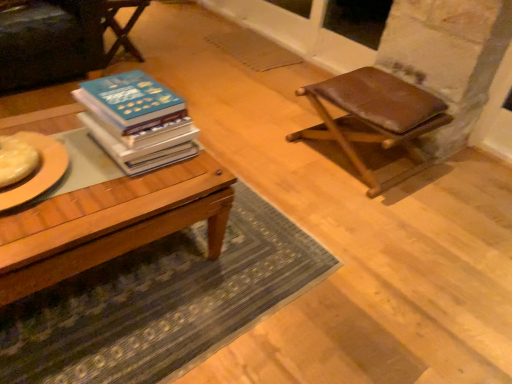
What are the coordinates of `free area in between brown leather stool at right and green textured rug at lower center` in the screenshot? It's located at (305, 184).